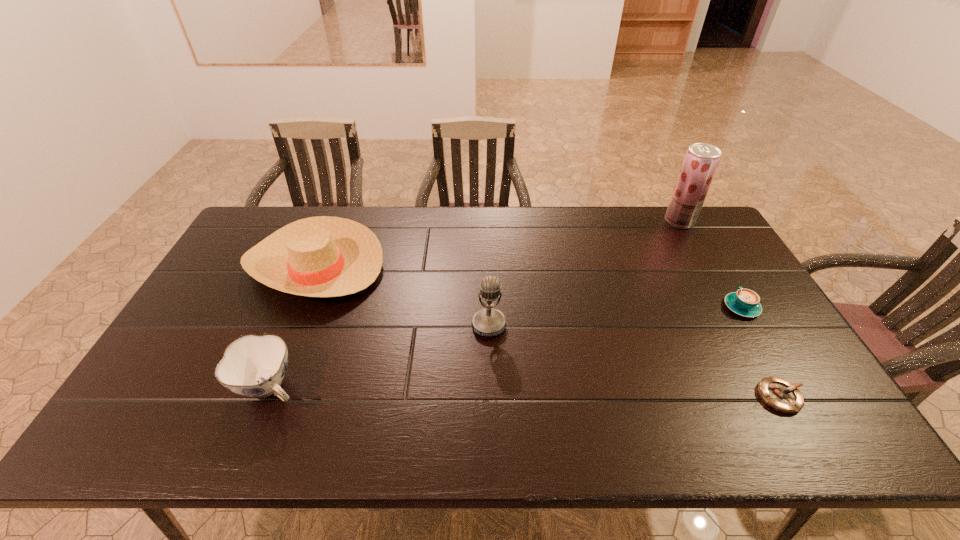
Image resolution: width=960 pixels, height=540 pixels. Find the location of `vacant space that is in between the chinaware and the tallest object`. vacant space that is in between the chinaware and the tallest object is located at coordinates (475, 304).

You are a GUI agent. You are given a task and a screenshot of the screen. Output one action in this format:
    pyautogui.click(x=<x>, y=<y>)
    Task: Click on the free area in between the ashtray and the chinaware
    
    Given the screenshot: What is the action you would take?
    pyautogui.click(x=525, y=392)

Identify the location of free area in between the tallest object and the fifth tallest object. (710, 264).

Locate an element on the screen. free space that is in between the tallest object and the sunhat is located at coordinates (497, 244).

Find the location of a particular element. vacant space that's between the shortest object and the cappuccino is located at coordinates (761, 352).

Locate an element on the screen. Image resolution: width=960 pixels, height=540 pixels. free space between the cappuccino and the chinaware is located at coordinates (506, 347).

The width and height of the screenshot is (960, 540). I want to click on vacant point located between the tallest object and the chinaware, so click(x=475, y=304).

The width and height of the screenshot is (960, 540). Find the location of `free point between the microphone and the sunhat`. free point between the microphone and the sunhat is located at coordinates (402, 296).

At what (x,y) coordinates should I click in order to perform the action: click on object that ranks as the second closest to the sunhat. Please return your answer as a coordinate pair (x, y). The image size is (960, 540). Looking at the image, I should click on (489, 322).

Identify the location of the third closest object to the chinaware. (779, 394).